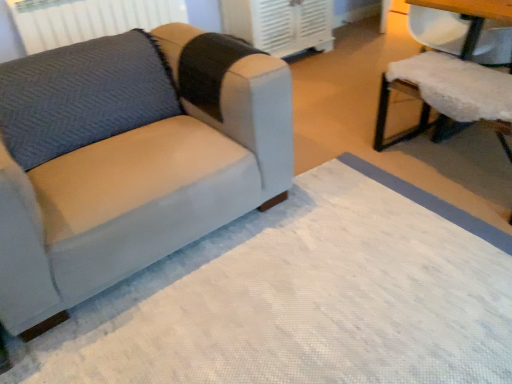
Question: Should I look upward or downward to see white plastic air conditioner at upper center?

Choices:
 (A) down
 (B) up

Answer: (B)

Question: Can you confirm if white fluffy cushion at right is positioned to the left of white textured mat at lower left?

Choices:
 (A) no
 (B) yes

Answer: (A)

Question: From a real-world perspective, is white fluffy cushion at right over white textured mat at lower left?

Choices:
 (A) no
 (B) yes

Answer: (B)

Question: Does white fluffy cushion at right have a lesser width compared to white textured mat at lower left?

Choices:
 (A) yes
 (B) no

Answer: (A)

Question: From a real-world perspective, is white fluffy cushion at right physically below white textured mat at lower left?

Choices:
 (A) no
 (B) yes

Answer: (A)

Question: Is white textured mat at lower left at the back of white fluffy cushion at right?

Choices:
 (A) no
 (B) yes

Answer: (A)

Question: Can you confirm if white fluffy cushion at right is shorter than white textured mat at lower left?

Choices:
 (A) yes
 (B) no

Answer: (B)

Question: Considering the relative positions of white plastic air conditioner at upper center and white fluffy cushion at right in the image provided, is white plastic air conditioner at upper center in front of white fluffy cushion at right?

Choices:
 (A) no
 (B) yes

Answer: (A)

Question: Is white plastic air conditioner at upper center touching white fluffy cushion at right?

Choices:
 (A) yes
 (B) no

Answer: (B)

Question: Are white plastic air conditioner at upper center and white fluffy cushion at right located far from each other?

Choices:
 (A) yes
 (B) no

Answer: (A)

Question: Considering the relative sizes of white plastic air conditioner at upper center and white fluffy cushion at right in the image provided, is white plastic air conditioner at upper center taller than white fluffy cushion at right?

Choices:
 (A) no
 (B) yes

Answer: (A)

Question: From the image's perspective, is white plastic air conditioner at upper center on top of white fluffy cushion at right?

Choices:
 (A) no
 (B) yes

Answer: (B)

Question: From a real-world perspective, does white plastic air conditioner at upper center stand above white fluffy cushion at right?

Choices:
 (A) no
 (B) yes

Answer: (A)

Question: Can you confirm if white fluffy cushion at right is taller than suede-like gray couch at left?

Choices:
 (A) yes
 (B) no

Answer: (A)